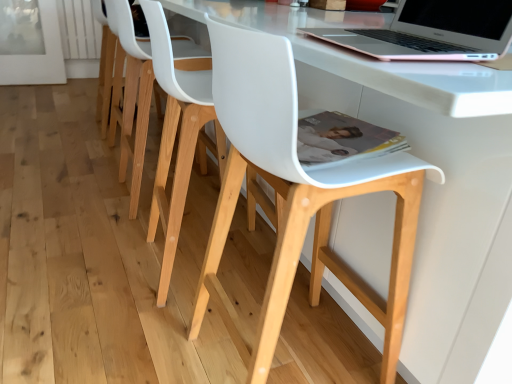
Question: Is rose gold aluminum laptop at upper right not close to white matte plastic chair at center, positioned as the second chair in back-to-front order?

Choices:
 (A) no
 (B) yes

Answer: (A)

Question: Is rose gold aluminum laptop at upper right directly adjacent to white matte plastic chair at center, positioned as the second chair in back-to-front order?

Choices:
 (A) no
 (B) yes

Answer: (A)

Question: Is the position of rose gold aluminum laptop at upper right more distant than that of white matte plastic chair at center, which appears as the second chair when viewed from the front?

Choices:
 (A) no
 (B) yes

Answer: (A)

Question: From the image's perspective, is rose gold aluminum laptop at upper right under white matte plastic chair at center, positioned as the second chair in back-to-front order?

Choices:
 (A) no
 (B) yes

Answer: (A)

Question: Does rose gold aluminum laptop at upper right appear on the left side of white matte plastic chair at center, positioned as the second chair in back-to-front order?

Choices:
 (A) yes
 (B) no

Answer: (B)

Question: From the image's perspective, is rose gold aluminum laptop at upper right above white matte plastic chair at center, which appears as the second chair when viewed from the front?

Choices:
 (A) no
 (B) yes

Answer: (B)

Question: Considering the relative positions of white matte chair at center, acting as the third chair starting from the back, and white matte chair at center, which ranks as the third chair in front-to-back order, in the image provided, is white matte chair at center, acting as the third chair starting from the back, to the left of white matte chair at center, which ranks as the third chair in front-to-back order, from the viewer's perspective?

Choices:
 (A) no
 (B) yes

Answer: (A)

Question: From a real-world perspective, is white matte chair at center, which is counted as the first chair, starting from the front, beneath white matte chair at center, the first chair from the back?

Choices:
 (A) yes
 (B) no

Answer: (B)

Question: Is white matte chair at center, which is counted as the first chair, starting from the front, thinner than white matte chair at center, which ranks as the third chair in front-to-back order?

Choices:
 (A) no
 (B) yes

Answer: (A)

Question: Is white matte chair at center, acting as the third chair starting from the back, not inside white matte chair at center, the first chair from the back?

Choices:
 (A) no
 (B) yes

Answer: (B)

Question: Is white matte chair at center, which is counted as the first chair, starting from the front, surrounding white matte chair at center, the first chair from the back?

Choices:
 (A) no
 (B) yes

Answer: (A)

Question: Considering the relative sizes of white matte chair at center, which is counted as the first chair, starting from the front, and rose gold aluminum laptop at upper right in the image provided, is white matte chair at center, which is counted as the first chair, starting from the front, thinner than rose gold aluminum laptop at upper right?

Choices:
 (A) no
 (B) yes

Answer: (A)